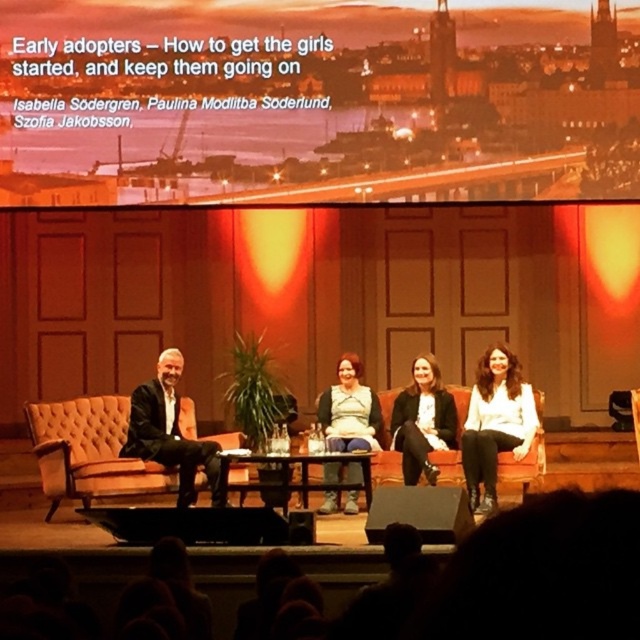
You are an event organizer who needs to place a name tag on the wooden at center. Where should you place the name tag relative to the black leather jacket at left?

The name tag should be placed to the right of the black leather jacket at left since the wooden at center is located to the right of it.